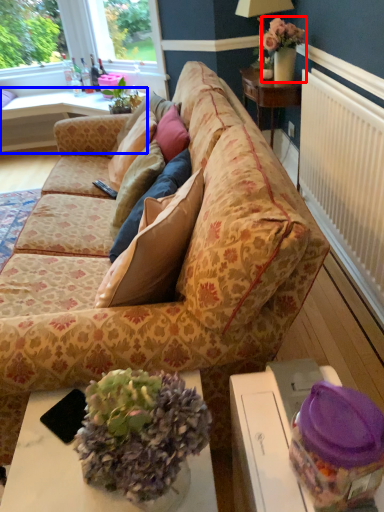
Question: Among these objects, which one is nearest to the camera, houseplant (highlighted by a red box) or table (highlighted by a blue box)?

Choices:
 (A) houseplant
 (B) table

Answer: (A)